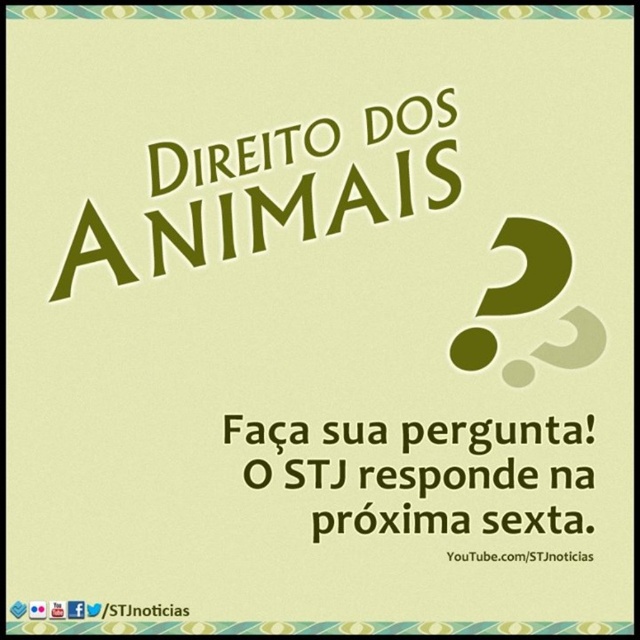
Between white paper text at center and green matte question mark at center, which one appears on the left side from the viewer's perspective?

white paper text at center

Does white paper text at center appear under green matte question mark at center?

Yes.

Find the location of a particular element. The width and height of the screenshot is (640, 640). white paper text at center is located at coordinates (387, 468).

Between whitetexturl at center and black paper at lower left, which one is positioned higher?

Positioned higher is whitetexturl at center.

Between point (486, 554) and point (188, 609), which one is positioned in front?

Point (188, 609)

Does point (483, 552) lie in front of point (163, 616)?

No, it is behind (163, 616).

What are the coordinates of `whitetexturl at center` in the screenshot? It's located at (518, 556).

Measure the distance from white paper text at center to whitetexturl at center.

white paper text at center is 2.87 inches away from whitetexturl at center.

Who is higher up, white paper text at center or whitetexturl at center?

Positioned higher is white paper text at center.

The image size is (640, 640). Identify the location of white paper text at center. (387, 468).